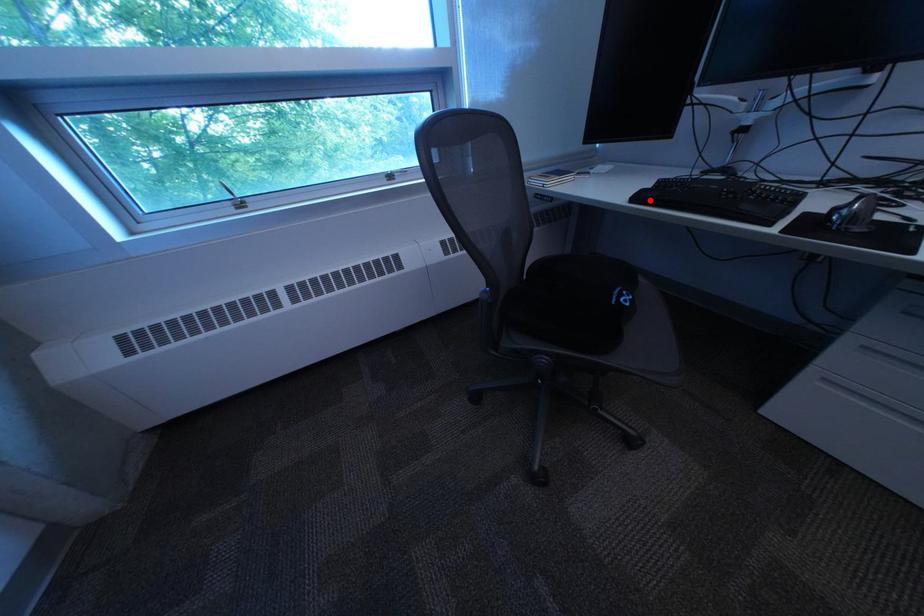
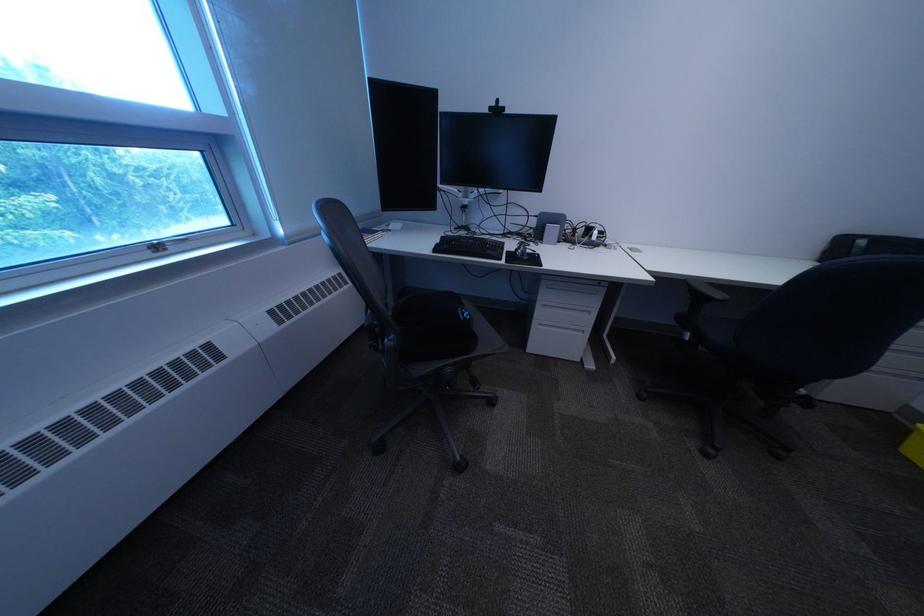
In the second image, find the point that corresponds to the highlighted location in the first image.

(451, 252)